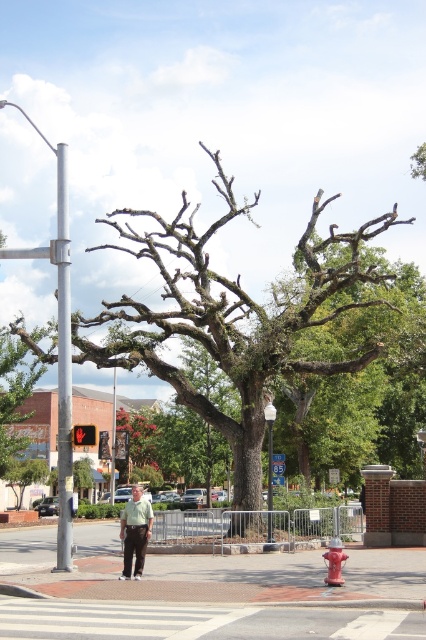
Does white asphalt at center appear over red glass traffic light at upper left?

Actually, white asphalt at center is below red glass traffic light at upper left.

This screenshot has height=640, width=426. Identify the location of white asphalt at center. (199, 621).

Who is shorter, red matte fire hydrant at lower right or red glass traffic light at upper left?

red matte fire hydrant at lower right is shorter.

This screenshot has width=426, height=640. I want to click on red matte fire hydrant at lower right, so click(x=334, y=563).

Does point (328, 566) come farther from viewer compared to point (85, 433)?

No, it is not.

I want to click on red matte fire hydrant at lower right, so click(x=334, y=563).

Who is higher up, white asphalt at center or light green shirt at center?

Positioned higher is white asphalt at center.

Is point (89, 630) closer to camera compared to point (134, 522)?

Yes, it is.

The width and height of the screenshot is (426, 640). Identify the location of white asphalt at center. (199, 621).